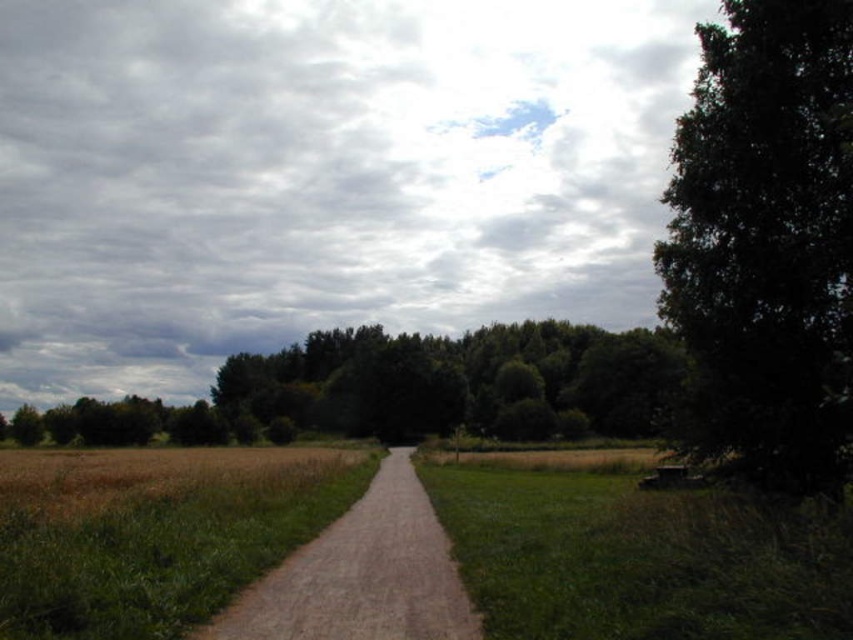
Question: Does dark green leafy tree at right have a larger size compared to dirt/gravel path at center?

Choices:
 (A) yes
 (B) no

Answer: (A)

Question: In this image, where is green leafy trees at center located relative to dirt/gravel path at center?

Choices:
 (A) below
 (B) above

Answer: (A)

Question: Which point is closer to the camera?

Choices:
 (A) green leafy trees at center
 (B) dark green leafy tree at right
 (C) dirt/gravel path at center

Answer: (C)

Question: Is dark green leafy tree at right wider than green leafy trees at center?

Choices:
 (A) yes
 (B) no

Answer: (B)

Question: Which point appears closest to the camera in this image?

Choices:
 (A) (805, 4)
 (B) (251, 376)

Answer: (A)

Question: Which of the following is the closest to the observer?

Choices:
 (A) dirt/gravel path at center
 (B) dark green leafy tree at right

Answer: (A)